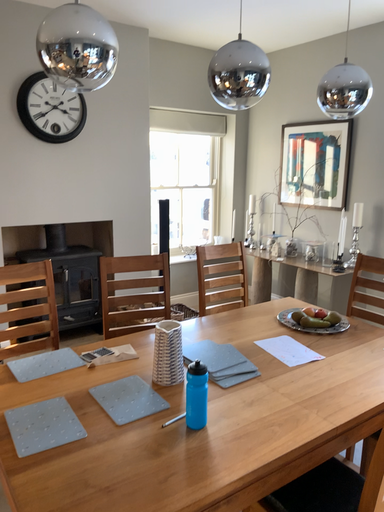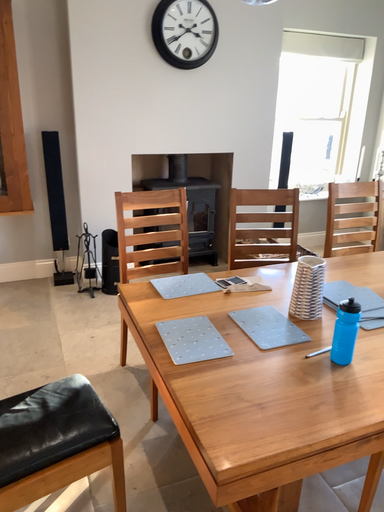
Question: How did the camera likely rotate when shooting the video?

Choices:
 (A) rotated upward
 (B) rotated downward

Answer: (B)